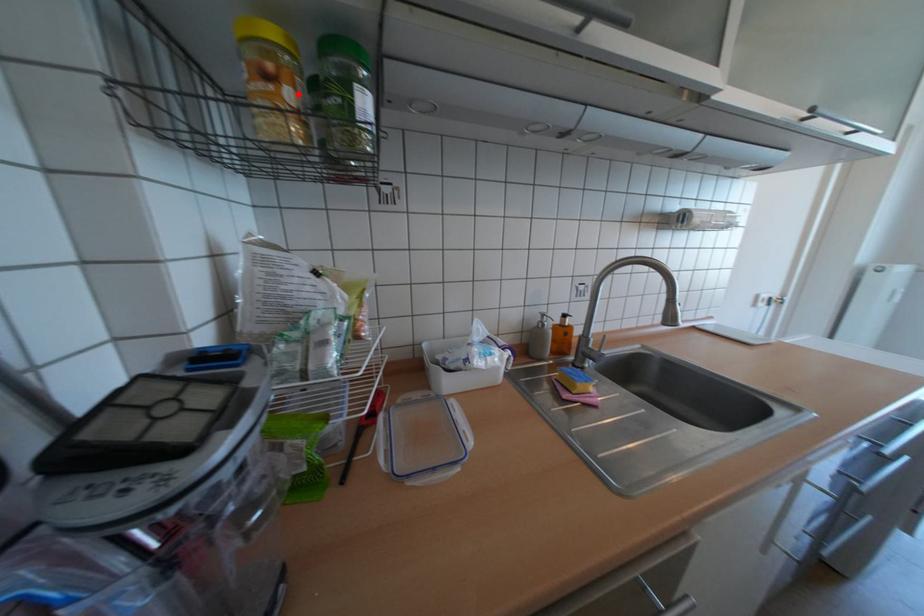
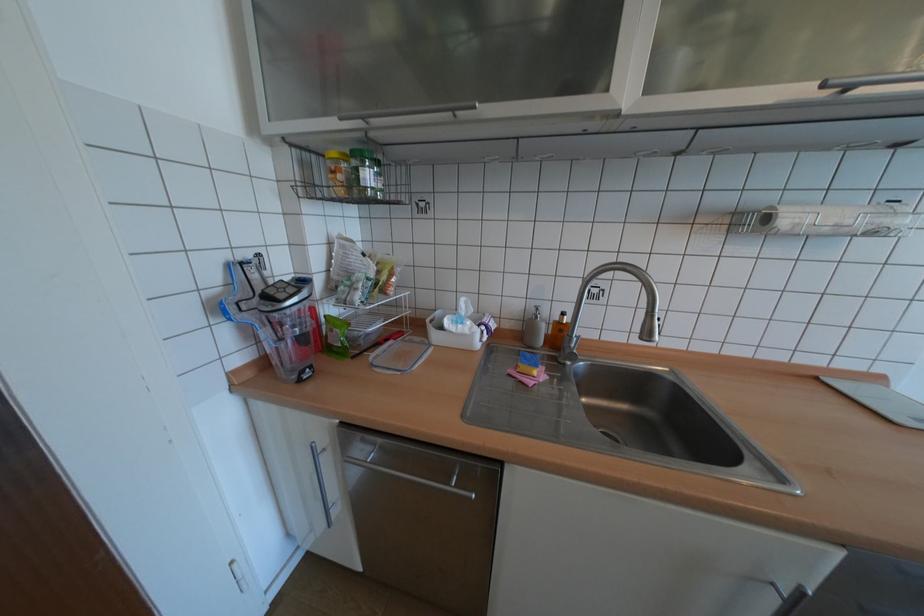
In the second image, find the point that corresponds to the highlighted location in the first image.

(348, 177)